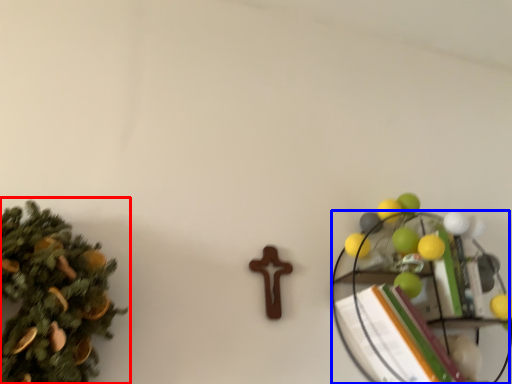
Question: Which point is closer to the camera, christmas tree (highlighted by a red box) or shelf (highlighted by a blue box)?

Choices:
 (A) christmas tree
 (B) shelf

Answer: (A)